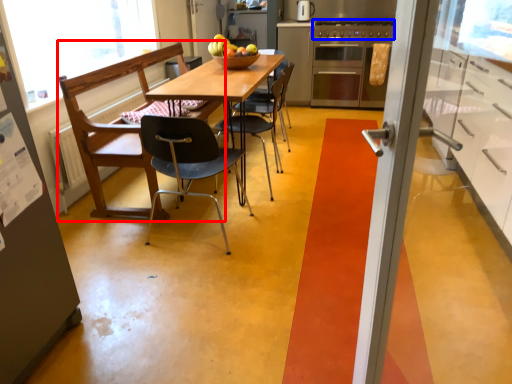
Question: Which object is further to the camera taking this photo, chair (highlighted by a red box) or stove (highlighted by a blue box)?

Choices:
 (A) chair
 (B) stove

Answer: (B)